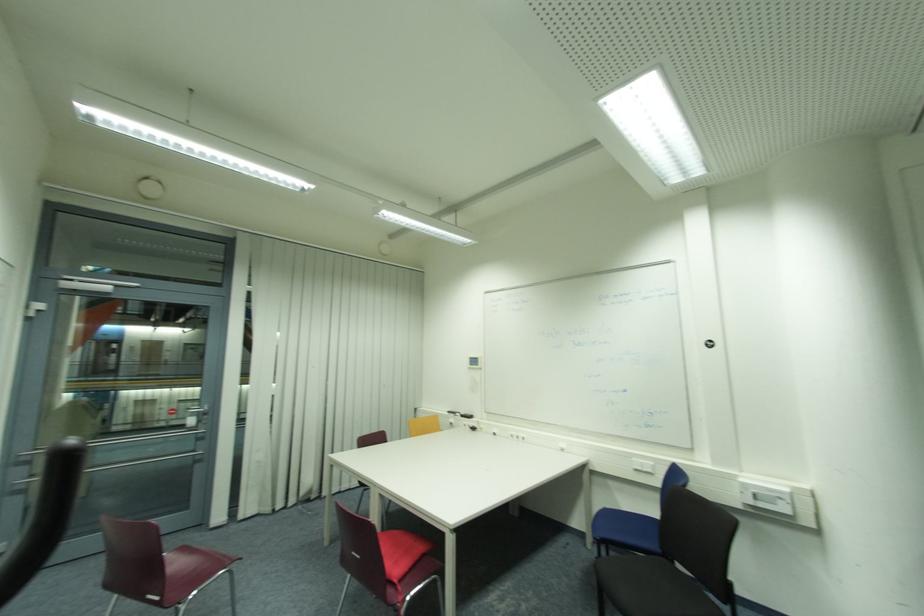
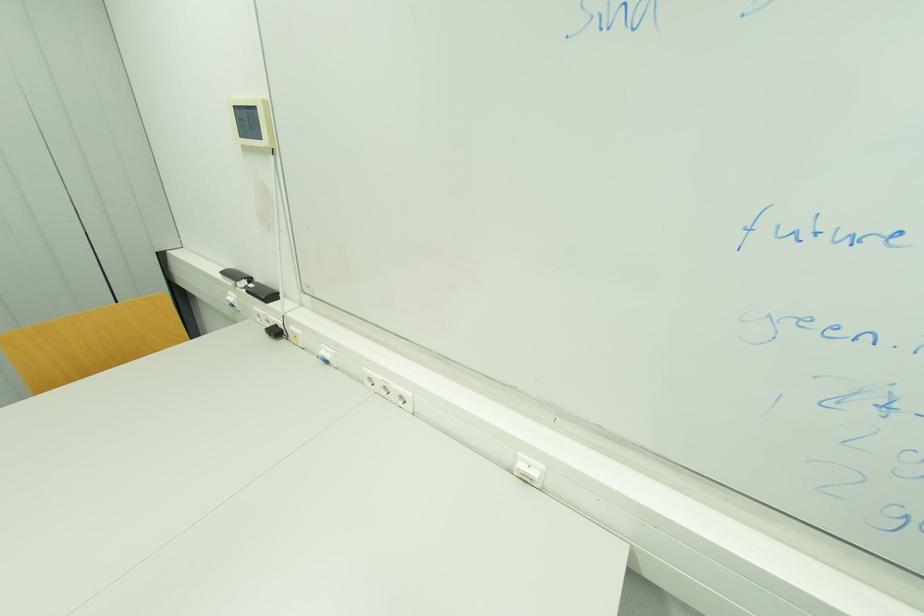
Locate, in the second image, the point that corresponds to (x=478, y=430) in the first image.

(281, 333)